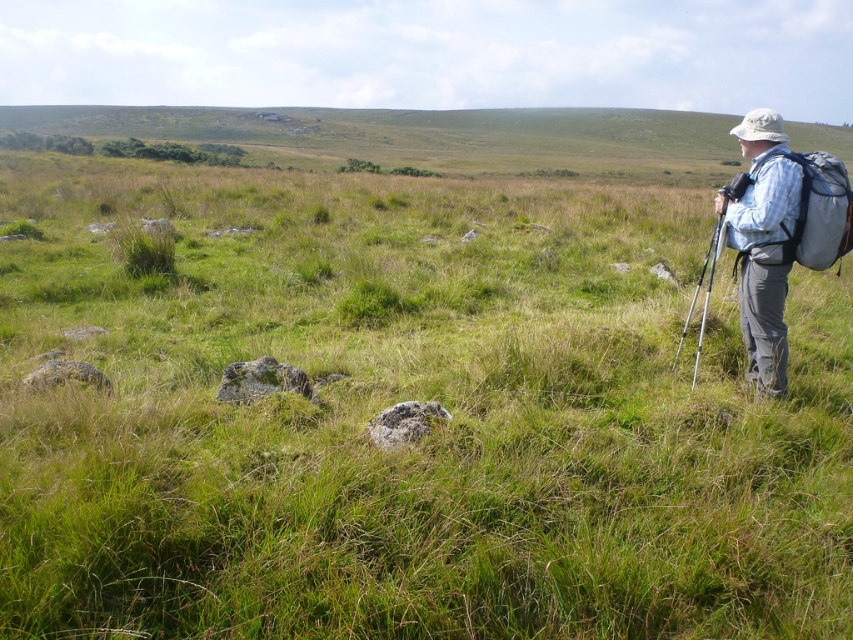
You are planning to take a photo of the blue plaid shirt at right and the gray fabric backpack at right in the serene landscape. Which object should you zoom in on to capture more details of its texture, considering their sizes in the image?

The blue plaid shirt at right has a larger width than the gray fabric backpack at right, so zooming in on the blue plaid shirt at right would allow you to capture more details of its texture without losing clarity.

In the scene shown: You are an outdoor enthusiast planning to take a photo of the blue plaid shirt at right and the gray fabric backpack at right in the serene landscape. Which object should you focus on first if you want to capture both in a single frame without moving the camera? Explain your reasoning based on their sizes.

The blue plaid shirt at right is bigger than the gray fabric backpack at right, so focusing on the larger blue plaid shirt at right will ensure it is in sharp focus while the smaller backpack remains within the depth of field, allowing both to be captured clearly in the same frame.

You are standing at the origin point in the center of the image. You see two points marked in the scene. Which point is closer to you, point (780, 275) or point (809, 192)?

Point (809, 192) is closer to you because it is in front of point (780, 275).